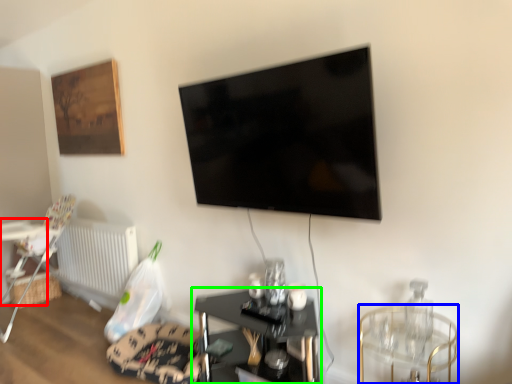
Question: Considering the real-world distances, which object is farthest from table (highlighted by a red box)? glass table (highlighted by a blue box) or table (highlighted by a green box)?

Choices:
 (A) glass table
 (B) table

Answer: (A)